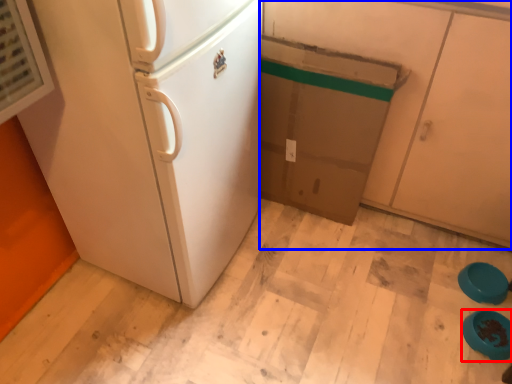
Question: Which of the following is the farthest to the observer, appliance (highlighted by a red box) or cabinetry (highlighted by a blue box)?

Choices:
 (A) appliance
 (B) cabinetry

Answer: (A)